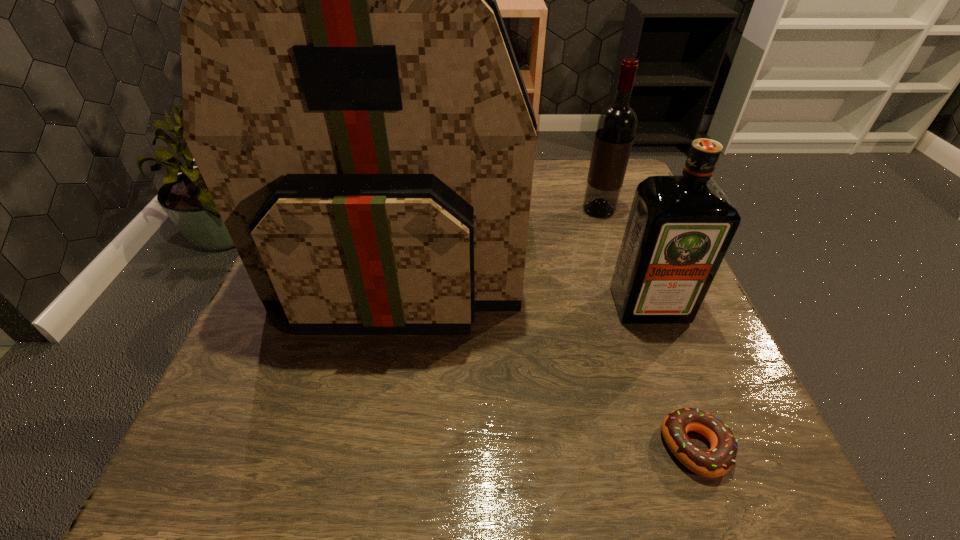
Image resolution: width=960 pixels, height=540 pixels. What are the coordinates of `object identified as the third closest to the backpack` in the screenshot? It's located at (717, 461).

What are the coordinates of `object that is the second closest one to the wine bottle` in the screenshot? It's located at (679, 228).

Image resolution: width=960 pixels, height=540 pixels. I want to click on vacant space that satisfies the following two spatial constraints: 1. on the front face of the shortest object; 2. on the left side of the backpack, so click(367, 447).

You are a GUI agent. You are given a task and a screenshot of the screen. Output one action in this format:
    pyautogui.click(x=<x>, y=<y>)
    Task: Click on the free space that satisfies the following two spatial constraints: 1. on the front face of the doughnut; 2. on the right side of the backpack
    
    Given the screenshot: What is the action you would take?
    pyautogui.click(x=367, y=447)

Locate an element on the screen. The width and height of the screenshot is (960, 540). free spot that satisfies the following two spatial constraints: 1. on the front face of the doughnut; 2. on the left side of the backpack is located at coordinates (367, 447).